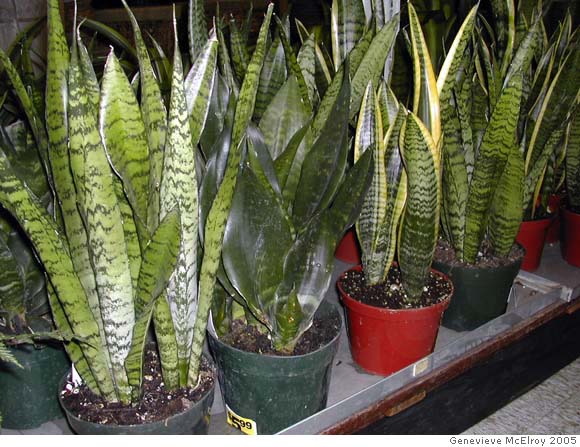
Locate an element on the screen. This screenshot has width=580, height=447. green planters is located at coordinates (43, 366), (192, 419), (267, 398), (474, 300).